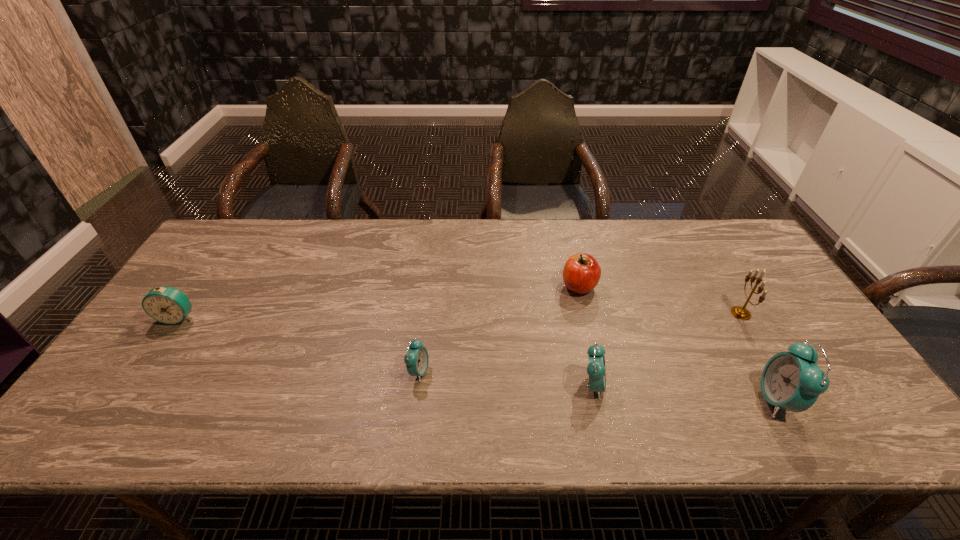
Please show where to add a alarm clock on the left while keeping spacing even. Please provide its 2D coordinates. Your answer should be formatted as a tuple, i.e. [(x, y)], where the tuple contains the x and y coordinates of a point satisfying the conditions above.

[(253, 359)]